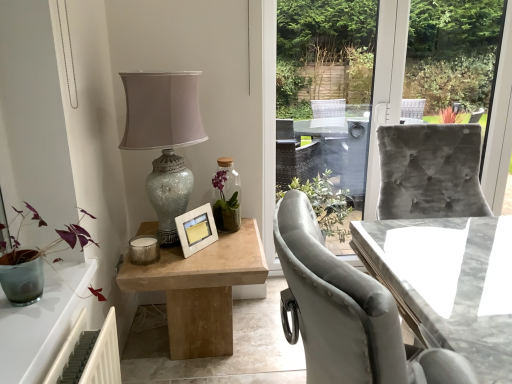
What are the coordinates of `blank space to the left of white matte picture frame at center` in the screenshot? It's located at (166, 254).